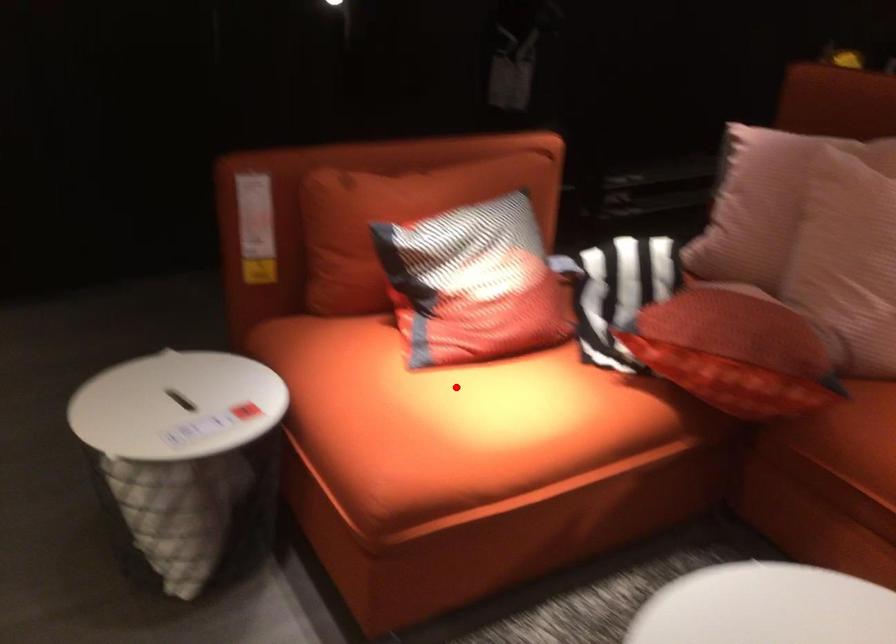
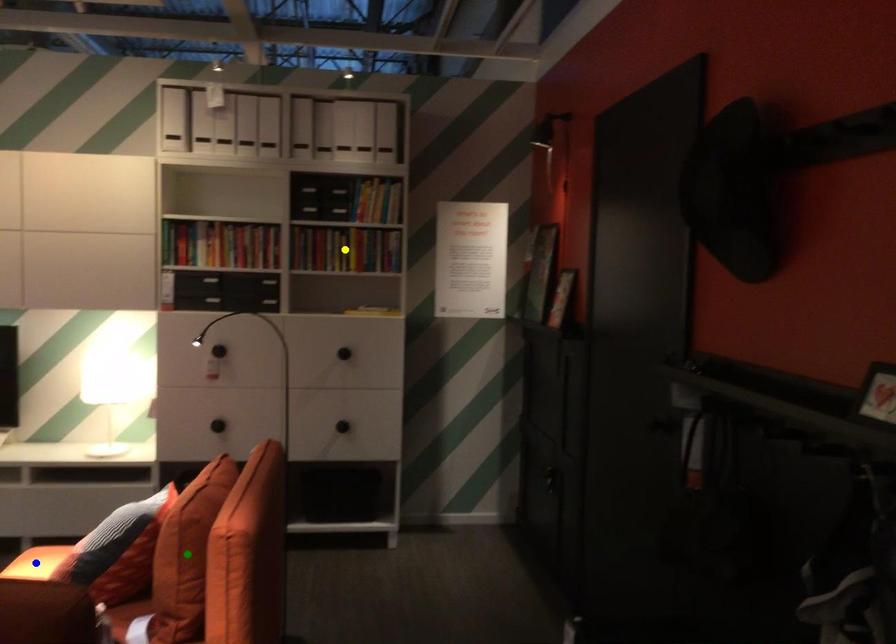
Question: I am providing you with two images of the same scene from different viewpoints. A red point is marked on the first image. You are given multiple points on the second image. Which point in image 2 is actually the same real-world point as the red point in image 1?

Choices:
 (A) yellow point
 (B) blue point
 (C) green point

Answer: (B)